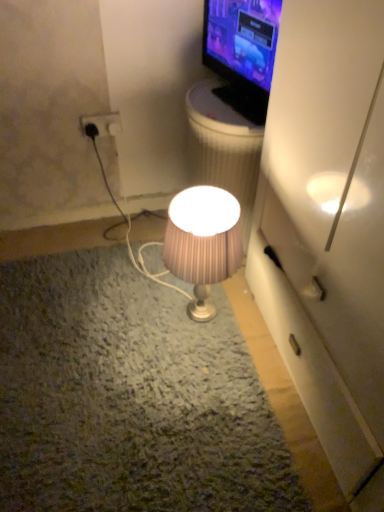
Locate an element on the screen. The width and height of the screenshot is (384, 512). white plastic trash bin/can at upper center is located at coordinates (223, 147).

The height and width of the screenshot is (512, 384). What do you see at coordinates (242, 52) in the screenshot?
I see `matte black tv at upper right` at bounding box center [242, 52].

Where is `white plastic trash bin/can at upper center`? The image size is (384, 512). white plastic trash bin/can at upper center is located at coordinates (223, 147).

How far apart are white plastic trash bin/can at upper center and black plastic power outlet at upper left?

white plastic trash bin/can at upper center is 45.87 centimeters away from black plastic power outlet at upper left.

Between white plastic trash bin/can at upper center and black plastic power outlet at upper left, which one has larger width?

white plastic trash bin/can at upper center.

Does white plastic trash bin/can at upper center have a greater height compared to black plastic power outlet at upper left?

Yes.

From a real-world perspective, is white plastic trash bin/can at upper center on top of black plastic power outlet at upper left?

No, from a real-world perspective, white plastic trash bin/can at upper center is not over black plastic power outlet at upper left

Can you tell me how much black plastic power outlet at upper left and pink pleated fabric lampshade at center differ in facing direction?

91.4 degrees.

Would you consider black plastic power outlet at upper left to be distant from pink pleated fabric lampshade at center?

black plastic power outlet at upper left is near pink pleated fabric lampshade at center, not far away.

From a real-world perspective, is black plastic power outlet at upper left located higher than pink pleated fabric lampshade at center?

Indeed, from a real-world perspective, black plastic power outlet at upper left stands above pink pleated fabric lampshade at center.

Does point (102, 114) come closer to viewer compared to point (167, 263)?

No, it is not.

Is matte black tv at upper right facing towards white plastic trash bin/can at upper center?

No, matte black tv at upper right is not facing towards white plastic trash bin/can at upper center.

Would you say matte black tv at upper right is outside white plastic trash bin/can at upper center?

Yes, matte black tv at upper right is located beyond the bounds of white plastic trash bin/can at upper center.

Which of these two, matte black tv at upper right or white plastic trash bin/can at upper center, is smaller?

With smaller size is matte black tv at upper right.

From a real-world perspective, is pink pleated fabric lampshade at center positioned over white plastic trash bin/can at upper center based on gravity?

Actually, pink pleated fabric lampshade at center is physically below white plastic trash bin/can at upper center in the real world.

Which is less distant, (203, 297) or (229, 188)?

Point (203, 297) appears to be farther away from the viewer than point (229, 188).

Considering the relative positions of pink pleated fabric lampshade at center and white plastic trash bin/can at upper center in the image provided, is pink pleated fabric lampshade at center to the right of white plastic trash bin/can at upper center from the viewer's perspective?

No, pink pleated fabric lampshade at center is not to the right of white plastic trash bin/can at upper center.

Considering the relative positions of pink pleated fabric lampshade at center and white plastic trash bin/can at upper center in the image provided, is pink pleated fabric lampshade at center in front of white plastic trash bin/can at upper center?

Yes, it is in front of white plastic trash bin/can at upper center.

Is matte black tv at upper right aimed at pink pleated fabric lampshade at center?

No, matte black tv at upper right is not oriented towards pink pleated fabric lampshade at center.

Considering the sizes of objects matte black tv at upper right and pink pleated fabric lampshade at center in the image provided, who is thinner, matte black tv at upper right or pink pleated fabric lampshade at center?

matte black tv at upper right is thinner.

Between matte black tv at upper right and pink pleated fabric lampshade at center, which one has larger size?

pink pleated fabric lampshade at center is bigger.

From the image's perspective, is matte black tv at upper right positioned above or below pink pleated fabric lampshade at center?

Based on their image positions, matte black tv at upper right is located above pink pleated fabric lampshade at center.

From the image's perspective, relative to matte black tv at upper right, is white plastic trash bin/can at upper center above or below?

Clearly, from the image's perspective, white plastic trash bin/can at upper center is below matte black tv at upper right.

Is matte black tv at upper right at the back of white plastic trash bin/can at upper center?

No.

Is white plastic trash bin/can at upper center in front of matte black tv at upper right?

No, white plastic trash bin/can at upper center is further to the viewer.

From a real-world perspective, which object stands above the other?

From a 3D spatial view, matte black tv at upper right is above.

Consider the image. Between pink pleated fabric lampshade at center and black plastic power outlet at upper left, which one has smaller width?

With smaller width is black plastic power outlet at upper left.

Which is closer to the camera, (209, 256) or (110, 123)?

Point (209, 256) appears to be closer to the viewer than point (110, 123).

From their relative heights in the image, would you say pink pleated fabric lampshade at center is taller or shorter than black plastic power outlet at upper left?

Clearly, pink pleated fabric lampshade at center is taller compared to black plastic power outlet at upper left.

Is pink pleated fabric lampshade at center not inside black plastic power outlet at upper left?

Yes.

Where is `power outlet behind the white plastic trash bin/can at upper center`? power outlet behind the white plastic trash bin/can at upper center is located at coordinates (102, 124).

You are a GUI agent. You are given a task and a screenshot of the screen. Output one action in this format:
    pyautogui.click(x=<x>, y=<y>)
    Task: Click on the power outlet lying on the left of pink pleated fabric lampshade at center
    The height and width of the screenshot is (512, 384).
    Given the screenshot: What is the action you would take?
    pyautogui.click(x=102, y=124)

Which object lies further to the anchor point matte black tv at upper right, black plastic power outlet at upper left or pink pleated fabric lampshade at center?

Based on the image, black plastic power outlet at upper left appears to be further to matte black tv at upper right.

Estimate the real-world distances between objects in this image. Which object is further from white plastic trash bin/can at upper center, matte black tv at upper right or pink pleated fabric lampshade at center?

The object further to white plastic trash bin/can at upper center is pink pleated fabric lampshade at center.

Looking at this image, from the image, which object appears to be farther from black plastic power outlet at upper left, pink pleated fabric lampshade at center or matte black tv at upper right?

pink pleated fabric lampshade at center is positioned further to the anchor black plastic power outlet at upper left.

Based on their spatial positions, is black plastic power outlet at upper left or matte black tv at upper right closer to pink pleated fabric lampshade at center?

matte black tv at upper right.

From the picture: Looking at the image, which one is located closer to black plastic power outlet at upper left, matte black tv at upper right or pink pleated fabric lampshade at center?

Among the two, matte black tv at upper right is located nearer to black plastic power outlet at upper left.

Estimate the real-world distances between objects in this image. Which object is further from matte black tv at upper right, pink pleated fabric lampshade at center or black plastic power outlet at upper left?

The object further to matte black tv at upper right is black plastic power outlet at upper left.

From the image, which object appears to be nearer to white plastic trash bin/can at upper center, pink pleated fabric lampshade at center or matte black tv at upper right?

matte black tv at upper right is closer to white plastic trash bin/can at upper center.

Which object lies nearer to the anchor point black plastic power outlet at upper left, white plastic trash bin/can at upper center or pink pleated fabric lampshade at center?

white plastic trash bin/can at upper center lies closer to black plastic power outlet at upper left than the other object.

The width and height of the screenshot is (384, 512). What are the coordinates of `power outlet between matte black tv at upper right and pink pleated fabric lampshade at center in the up-down direction` in the screenshot? It's located at [x=102, y=124].

Locate an element on the screen. This screenshot has width=384, height=512. trash bin/can between black plastic power outlet at upper left and matte black tv at upper right in the horizontal direction is located at coordinates (223, 147).

I want to click on trash bin/can between matte black tv at upper right and pink pleated fabric lampshade at center in the up-down direction, so click(x=223, y=147).

This screenshot has height=512, width=384. Identify the location of trash bin/can between black plastic power outlet at upper left and pink pleated fabric lampshade at center from top to bottom. (223, 147).